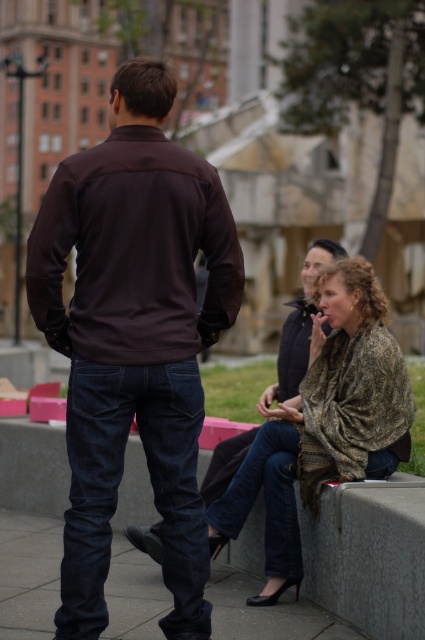
You are standing on the smooth concrete pavement at lower center and want to pick up the camouflage fabric scarf at lower right. Which direction should you move to reach it?

The camouflage fabric scarf at lower right is further to the viewer than the smooth concrete pavement at lower center, so you should move forward towards it.

You are standing on the smooth concrete pavement at lower center and want to pick up the camouflage fabric scarf at lower right. Is the scarf higher or lower than the pavement you are standing on?

The camouflage fabric scarf at lower right is much taller than the smooth concrete pavement at lower center, so the scarf is higher than the pavement you are standing on.